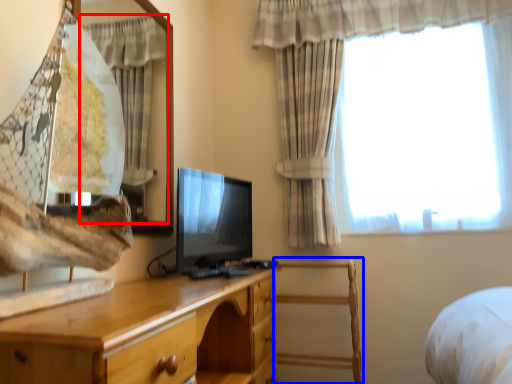
Question: Which point is closer to the camera, curtain (highlighted by a red box) or chair (highlighted by a blue box)?

Choices:
 (A) curtain
 (B) chair

Answer: (A)